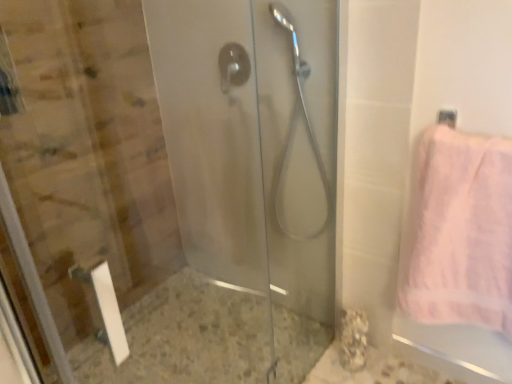
The width and height of the screenshot is (512, 384). Describe the element at coordinates (461, 232) in the screenshot. I see `pink fluffy towel at right` at that location.

Where is `transparent glass shower door at left`? transparent glass shower door at left is located at coordinates (168, 183).

In order to click on satin silver shower handle at center, placed as the second shower when sorted from right to left in this screenshot , I will do `click(233, 66)`.

Considering the sizes of satin nickel shower head at center, the second shower when ordered from left to right, and pink fluffy towel at right in the image, is satin nickel shower head at center, the second shower when ordered from left to right, taller or shorter than pink fluffy towel at right?

In the image, satin nickel shower head at center, the second shower when ordered from left to right, appears to be taller than pink fluffy towel at right.

How many degrees apart are the facing directions of satin nickel shower head at center, the 1th shower positioned from the right, and pink fluffy towel at right?

satin nickel shower head at center, the 1th shower positioned from the right, and pink fluffy towel at right are facing 2.93 degrees away from each other.

From a real-world perspective, is satin nickel shower head at center, the second shower when ordered from left to right, under pink fluffy towel at right?

No, from a real-world perspective, satin nickel shower head at center, the second shower when ordered from left to right, is not below pink fluffy towel at right.

Locate an element on the screen. towel below the satin nickel shower head at center, the second shower when ordered from left to right (from the image's perspective) is located at coordinates (461, 232).

Which is more distant, (241, 78) or (264, 374)?

The point (264, 374) is more distant.

Does satin silver shower handle at center, placed as the second shower when sorted from right to left, have a larger size compared to transparent glass shower door at left?

No, satin silver shower handle at center, placed as the second shower when sorted from right to left, is not bigger than transparent glass shower door at left.

Is satin silver shower handle at center, which ranks as the first shower in left-to-right order, situated inside transparent glass shower door at left or outside?

satin silver shower handle at center, which ranks as the first shower in left-to-right order, exists outside the volume of transparent glass shower door at left.

Is satin silver shower handle at center, which ranks as the first shower in left-to-right order, closer to the viewer compared to pink fluffy towel at right?

No, satin silver shower handle at center, which ranks as the first shower in left-to-right order, is behind pink fluffy towel at right.

Looking at this image, is satin silver shower handle at center, placed as the second shower when sorted from right to left, completely or partially outside of pink fluffy towel at right?

satin silver shower handle at center, placed as the second shower when sorted from right to left, lies outside pink fluffy towel at right's area.

Is satin silver shower handle at center, placed as the second shower when sorted from right to left, directly adjacent to pink fluffy towel at right?

No.

Considering the sizes of objects satin silver shower handle at center, which ranks as the first shower in left-to-right order, and pink fluffy towel at right in the image provided, who is thinner, satin silver shower handle at center, which ranks as the first shower in left-to-right order, or pink fluffy towel at right?

satin silver shower handle at center, which ranks as the first shower in left-to-right order.

Is satin nickel shower head at center, the second shower when ordered from left to right, aimed at transparent glass shower door at left?

Yes, satin nickel shower head at center, the second shower when ordered from left to right, is facing transparent glass shower door at left.

Can you confirm if satin nickel shower head at center, the 1th shower positioned from the right, is bigger than transparent glass shower door at left?

No, satin nickel shower head at center, the 1th shower positioned from the right, is not bigger than transparent glass shower door at left.

Which shower is the 1st one when counting from the back of the transparent glass shower door at left? Please provide its 2D coordinates.

[(294, 129)]

Measure the distance from satin nickel shower head at center, the second shower when ordered from left to right, to transparent glass shower door at left.

A distance of 51.19 centimeters exists between satin nickel shower head at center, the second shower when ordered from left to right, and transparent glass shower door at left.

From a real-world perspective, who is located lower, transparent glass shower door at left or satin silver shower handle at center, which ranks as the first shower in left-to-right order?

transparent glass shower door at left is physically lower.

Which of these two, transparent glass shower door at left or satin silver shower handle at center, which ranks as the first shower in left-to-right order, is thinner?

satin silver shower handle at center, which ranks as the first shower in left-to-right order.

Considering the positions of objects transparent glass shower door at left and satin silver shower handle at center, which ranks as the first shower in left-to-right order, in the image provided, who is more to the left, transparent glass shower door at left or satin silver shower handle at center, which ranks as the first shower in left-to-right order,?

satin silver shower handle at center, which ranks as the first shower in left-to-right order, is more to the left.

Could you tell me if transparent glass shower door at left is facing satin silver shower handle at center, which ranks as the first shower in left-to-right order?

No, transparent glass shower door at left does not turn towards satin silver shower handle at center, which ranks as the first shower in left-to-right order.

How many degrees apart are the facing directions of satin silver shower handle at center, placed as the second shower when sorted from right to left, and satin nickel shower head at center, the second shower when ordered from left to right?

The angle between the facing direction of satin silver shower handle at center, placed as the second shower when sorted from right to left, and the facing direction of satin nickel shower head at center, the second shower when ordered from left to right, is 11.4 degrees.

Does satin silver shower handle at center, which ranks as the first shower in left-to-right order, have a smaller size compared to satin nickel shower head at center, the second shower when ordered from left to right?

Yes, satin silver shower handle at center, which ranks as the first shower in left-to-right order, is smaller than satin nickel shower head at center, the second shower when ordered from left to right.

Do you think satin silver shower handle at center, placed as the second shower when sorted from right to left, is within satin nickel shower head at center, the second shower when ordered from left to right, or outside of it?

satin silver shower handle at center, placed as the second shower when sorted from right to left, is spatially situated outside satin nickel shower head at center, the second shower when ordered from left to right.

Find the location of `shower located on the right of satin silver shower handle at center, which ranks as the first shower in left-to-right order`. shower located on the right of satin silver shower handle at center, which ranks as the first shower in left-to-right order is located at coordinates (294, 129).

Is satin nickel shower head at center, the 1th shower positioned from the right, with satin silver shower handle at center, placed as the second shower when sorted from right to left?

satin nickel shower head at center, the 1th shower positioned from the right, and satin silver shower handle at center, placed as the second shower when sorted from right to left, are not in contact.

Is satin silver shower handle at center, placed as the second shower when sorted from right to left, surrounded by satin nickel shower head at center, the second shower when ordered from left to right?

No, satin silver shower handle at center, placed as the second shower when sorted from right to left, is not surrounded by satin nickel shower head at center, the second shower when ordered from left to right.

Considering the relative positions of satin nickel shower head at center, the 1th shower positioned from the right, and satin silver shower handle at center, placed as the second shower when sorted from right to left, in the image provided, is satin nickel shower head at center, the 1th shower positioned from the right, in front of satin silver shower handle at center, placed as the second shower when sorted from right to left,?

Yes, it is.

Locate an element on the screen. The width and height of the screenshot is (512, 384). shower below the satin silver shower handle at center, placed as the second shower when sorted from right to left (from the image's perspective) is located at coordinates (294, 129).

The width and height of the screenshot is (512, 384). I want to click on towel that is in front of the satin nickel shower head at center, the second shower when ordered from left to right, so click(x=461, y=232).

I want to click on screen door on the right of satin silver shower handle at center, which ranks as the first shower in left-to-right order, so click(x=168, y=183).

When comparing their distances from satin silver shower handle at center, which ranks as the first shower in left-to-right order, does transparent glass shower door at left or satin nickel shower head at center, the second shower when ordered from left to right, seem further?

transparent glass shower door at left is positioned further to the anchor satin silver shower handle at center, which ranks as the first shower in left-to-right order.

When comparing their distances from pink fluffy towel at right, does satin nickel shower head at center, the second shower when ordered from left to right, or transparent glass shower door at left seem closer?

satin nickel shower head at center, the second shower when ordered from left to right, is closer to pink fluffy towel at right.

Which object lies nearer to the anchor point satin silver shower handle at center, placed as the second shower when sorted from right to left, pink fluffy towel at right or transparent glass shower door at left?

The object closer to satin silver shower handle at center, placed as the second shower when sorted from right to left, is transparent glass shower door at left.

Considering their positions, is pink fluffy towel at right positioned further to satin silver shower handle at center, which ranks as the first shower in left-to-right order, than satin nickel shower head at center, the 1th shower positioned from the right?

Based on the image, pink fluffy towel at right appears to be further to satin silver shower handle at center, which ranks as the first shower in left-to-right order.

When comparing their distances from pink fluffy towel at right, does satin nickel shower head at center, the second shower when ordered from left to right, or satin silver shower handle at center, placed as the second shower when sorted from right to left, seem further?

Based on the image, satin silver shower handle at center, placed as the second shower when sorted from right to left, appears to be further to pink fluffy towel at right.

From the image, which object appears to be farther from pink fluffy towel at right, transparent glass shower door at left or satin silver shower handle at center, which ranks as the first shower in left-to-right order?

satin silver shower handle at center, which ranks as the first shower in left-to-right order, is positioned further to the anchor pink fluffy towel at right.

Considering their positions, is transparent glass shower door at left positioned closer to satin nickel shower head at center, the second shower when ordered from left to right, than pink fluffy towel at right?

Among the two, transparent glass shower door at left is located nearer to satin nickel shower head at center, the second shower when ordered from left to right.

In the scene shown: From the image, which object appears to be farther from transparent glass shower door at left, satin silver shower handle at center, placed as the second shower when sorted from right to left, or pink fluffy towel at right?

pink fluffy towel at right is further to transparent glass shower door at left.

This screenshot has height=384, width=512. Find the location of `towel located between transparent glass shower door at left and satin nickel shower head at center, the 1th shower positioned from the right, in the depth direction`. towel located between transparent glass shower door at left and satin nickel shower head at center, the 1th shower positioned from the right, in the depth direction is located at coordinates (461, 232).

The image size is (512, 384). In order to click on towel between transparent glass shower door at left and satin silver shower handle at center, which ranks as the first shower in left-to-right order, in the front-back direction in this screenshot , I will do `click(461, 232)`.

I want to click on shower between transparent glass shower door at left and satin silver shower handle at center, which ranks as the first shower in left-to-right order, along the z-axis, so click(x=294, y=129).

Identify the location of shower located between satin silver shower handle at center, which ranks as the first shower in left-to-right order, and pink fluffy towel at right in the left-right direction. Image resolution: width=512 pixels, height=384 pixels. (294, 129).